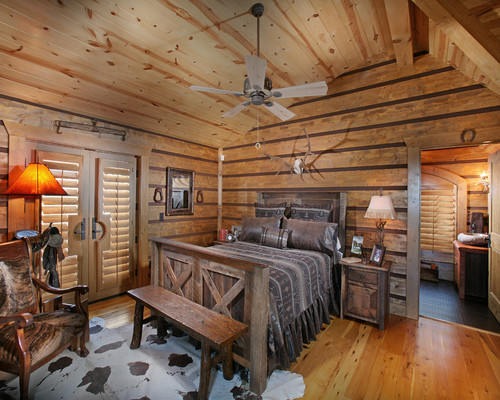
This screenshot has width=500, height=400. Find the location of `floor`. floor is located at coordinates (402, 389).